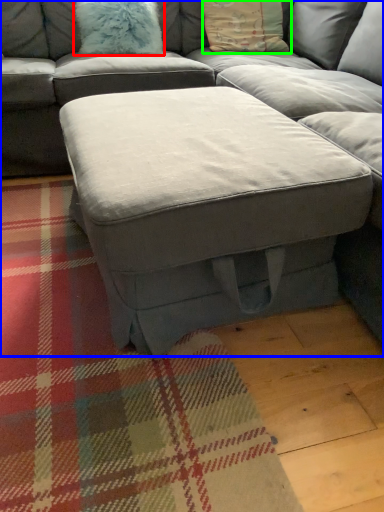
Question: Based on their relative distances, which object is nearer to pillow (highlighted by a red box)? Choose from studio couch (highlighted by a blue box) and pillow (highlighted by a green box).

Choices:
 (A) studio couch
 (B) pillow

Answer: (B)